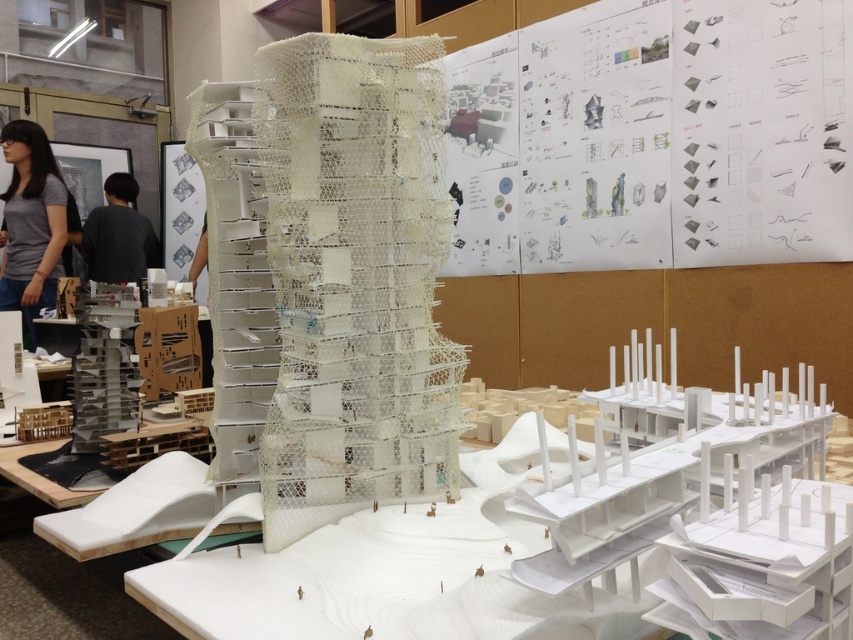
You are an architect reviewing the models in the studio and notice two shirts on the left side of the workspace. Which shirt is closer to the edge of the workspace, the gray matte shirt at left or the black shirt at left?

The gray matte shirt at left is closer to the edge of the workspace because it is positioned to the left of the black shirt at left.

You are an architect reviewing the architectural model in the studio. You notice a point marked at coordinates (32,224). What object or feature does this point correspond to in the scene?

The point at coordinates (32,224) corresponds to the gray matte shirt at left.